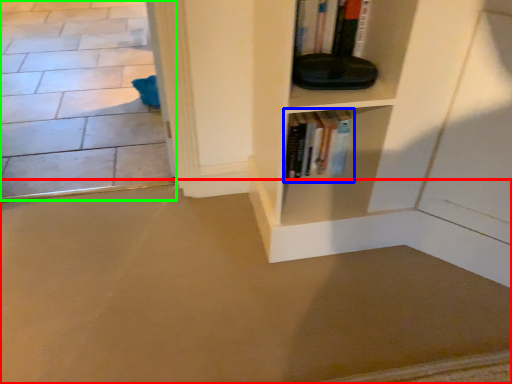
Question: Based on their relative distances, which object is farther from concrete (highlighted by a red box)? Choose from book (highlighted by a blue box) and concrete (highlighted by a green box).

Choices:
 (A) book
 (B) concrete

Answer: (B)